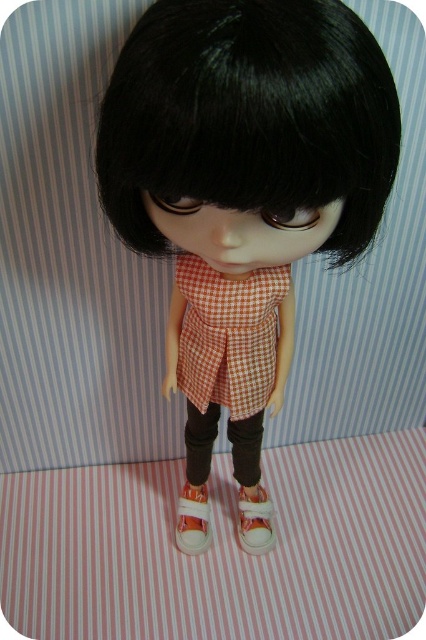
Looking at this image, you are standing in front of the doll and see two points marked on the image. The first point is at position point [276,22] and the second point is at point [198,506]. Which point is closer to you?

Point [276,22] is in front of point [198,506], so the first point is closer to you.

You are a photographer setting up a shoot for a doll. You need to ensure that the black matte wig at center and the white canvas shoe at lower center are visible in the frame. Given that the camera has a fixed focal length, which object should you prioritize positioning closer to the camera to ensure its full width is captured without distortion?

The black matte wig at center has a larger width than the white canvas shoe at lower center, so you should prioritize positioning the black matte wig at center closer to the camera to ensure its full width is captured without distortion.